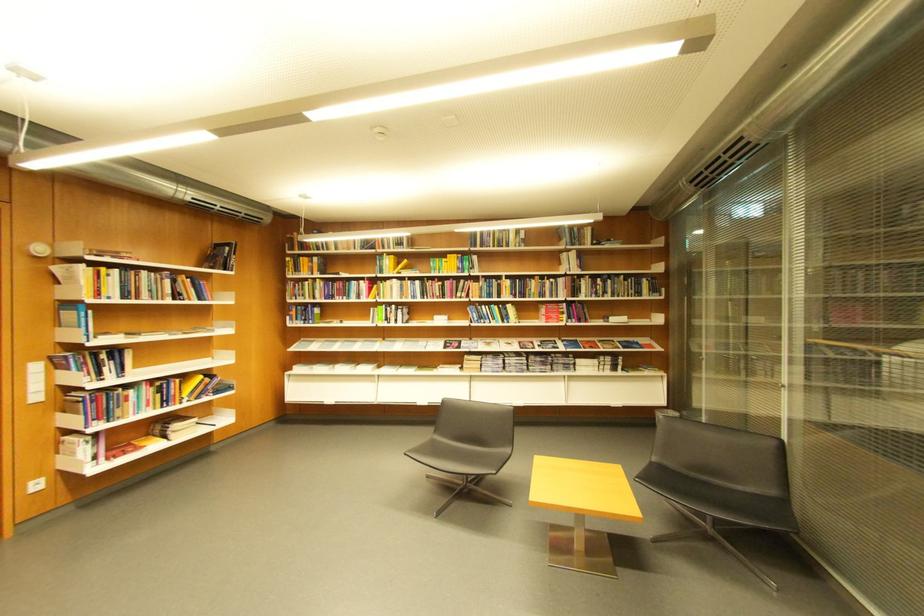
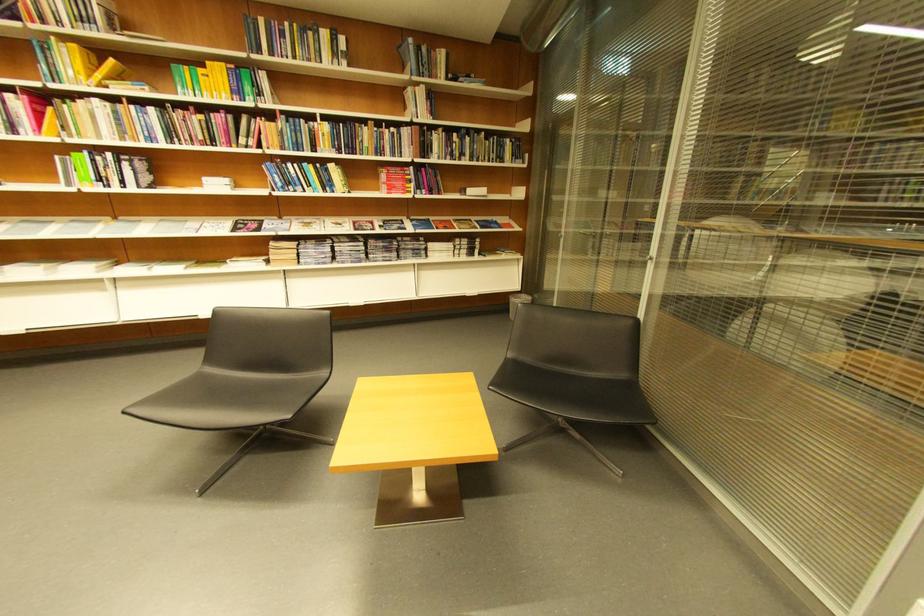
Where in the second image is the point corresponding to point (590, 246) from the first image?

(441, 78)